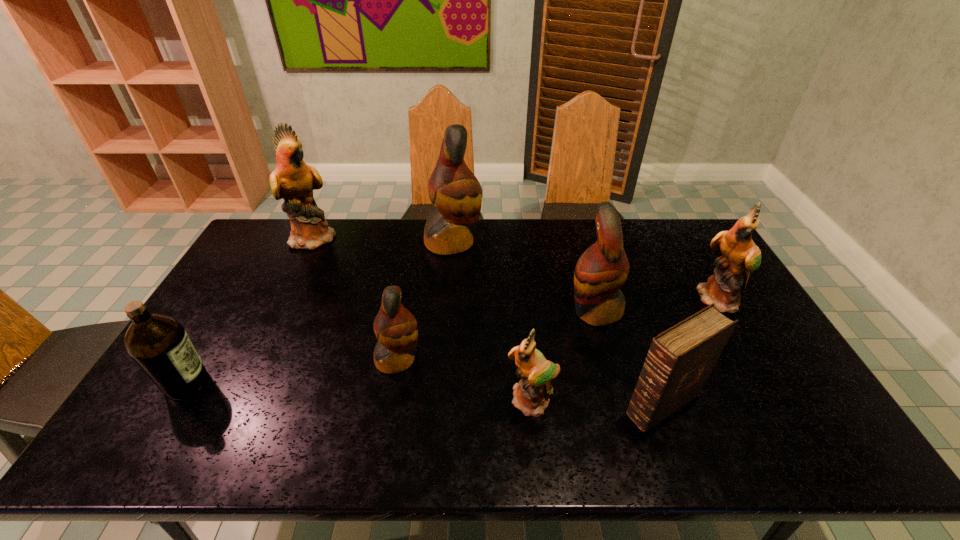
The height and width of the screenshot is (540, 960). I want to click on vacant space positioned on the label of the leftmost object, so click(263, 383).

At what (x,y) coordinates should I click in order to perform the action: click on blank area located 0.260m on the right of the Bible. Please return your answer as a coordinate pair (x, y). The width and height of the screenshot is (960, 540). Looking at the image, I should click on 806,405.

Identify the location of vacant area situated 0.210m on the face of the nearest red parrot. This screenshot has height=540, width=960. (498, 359).

Locate an element on the screen. object present at the near edge is located at coordinates (680, 359).

Locate an element on the screen. parrot located in the left edge section of the desktop is located at coordinates (292, 180).

You are a GUI agent. You are given a task and a screenshot of the screen. Output one action in this format:
    pyautogui.click(x=<x>, y=<y>)
    Task: Click on the olive oil that is at the left edge
    
    Given the screenshot: What is the action you would take?
    pyautogui.click(x=159, y=345)

Where is `object that is at the right edge`? The image size is (960, 540). object that is at the right edge is located at coordinates (740, 256).

You are a GUI agent. You are given a task and a screenshot of the screen. Output one action in this format:
    pyautogui.click(x=<x>, y=<y>)
    Task: Click on the object that is at the far left corner
    This screenshot has height=540, width=960.
    Given the screenshot: What is the action you would take?
    pyautogui.click(x=292, y=180)

You are a GUI agent. You are given a task and a screenshot of the screen. Output one action in this format:
    pyautogui.click(x=<x>, y=<y>)
    Task: Click on the free space at the far edge of the desktop
    The width and height of the screenshot is (960, 540).
    Given the screenshot: What is the action you would take?
    pyautogui.click(x=372, y=241)

Image resolution: width=960 pixels, height=540 pixels. Identify the location of vacant area at the near edge. (395, 427).